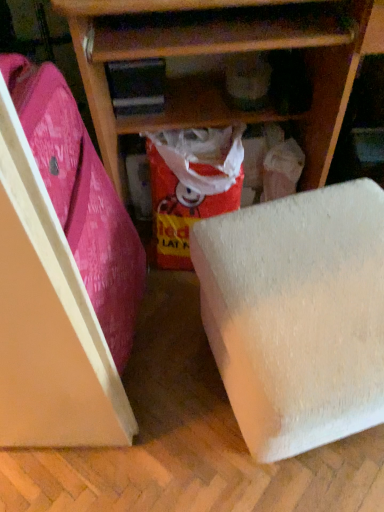
Find the location of `white foam block at lower right`. white foam block at lower right is located at coordinates (297, 315).

Describe the element at coordinates (297, 315) in the screenshot. I see `white foam block at lower right` at that location.

What is the approximate width of wooden shelf at center?

wooden shelf at center is 21.05 inches in width.

Find the location of `wooden shelf at center`. wooden shelf at center is located at coordinates (219, 74).

Measure the distance between red glossy paper at center and camera.

The depth of red glossy paper at center is 1.05 meters.

Find the location of a particular element. The width and height of the screenshot is (384, 512). pink fabric suitcase at left is located at coordinates (81, 198).

Is red glossy paper at center turned away from pink fabric suitcase at left?

No.

From a real-world perspective, is red glossy paper at center positioned above or below pink fabric suitcase at left?

Clearly, from a real-world perspective, red glossy paper at center is below pink fabric suitcase at left.

Is red glossy paper at center taller or shorter than pink fabric suitcase at left?

Considering their sizes, red glossy paper at center has less height than pink fabric suitcase at left.

From the image's perspective, is red glossy paper at center positioned above or below pink fabric suitcase at left?

Based on their image positions, red glossy paper at center is located above pink fabric suitcase at left.

The image size is (384, 512). I want to click on shelf that is on the left side of white foam block at lower right, so click(x=219, y=74).

In the scene shown: Are white foam block at lower right and wooden shelf at center far apart?

No, there isn't a large distance between white foam block at lower right and wooden shelf at center.

In terms of size, does white foam block at lower right appear bigger or smaller than wooden shelf at center?

In the image, white foam block at lower right appears to be smaller than wooden shelf at center.

From a real-world perspective, which object rests below the other?

white foam block at lower right.

Is the surface of red glossy paper at center in direct contact with wooden shelf at center?

There is a gap between red glossy paper at center and wooden shelf at center.

From the image's perspective, between red glossy paper at center and wooden shelf at center, who is located below?

red glossy paper at center, from the image's perspective.

Is red glossy paper at center looking in the opposite direction of wooden shelf at center?

That's right, red glossy paper at center is facing away from wooden shelf at center.

From the image's perspective, is pink fabric suitcase at left over red glossy paper at center?

No.

From a real-world perspective, is pink fabric suitcase at left over red glossy paper at center?

Yes, from a real-world perspective, pink fabric suitcase at left is above red glossy paper at center.

Is pink fabric suitcase at left directly adjacent to red glossy paper at center?

They are not placed beside each other.

Is red glossy paper at center touching white foam block at lower right?

red glossy paper at center is not next to white foam block at lower right, and they're not touching.

Image resolution: width=384 pixels, height=512 pixels. I want to click on wrapping paper above the white foam block at lower right (from the image's perspective), so click(x=191, y=185).

Based on the photo, considering the relative sizes of red glossy paper at center and white foam block at lower right in the image provided, is red glossy paper at center taller than white foam block at lower right?

No, red glossy paper at center is not taller than white foam block at lower right.

Is red glossy paper at center positioned beyond the bounds of white foam block at lower right?

red glossy paper at center is positioned outside white foam block at lower right.

Is red glossy paper at center inside white foam block at lower right?

Actually, red glossy paper at center is outside white foam block at lower right.

You are a GUI agent. You are given a task and a screenshot of the screen. Output one action in this format:
    pyautogui.click(x=<x>, y=<y>)
    Task: Click on the wrapping paper that appears behind the white foam block at lower right
    This screenshot has height=512, width=384.
    Given the screenshot: What is the action you would take?
    pyautogui.click(x=191, y=185)

Is there a large distance between white foam block at lower right and red glossy paper at center?

No, white foam block at lower right is in close proximity to red glossy paper at center.

In terms of width, does wooden shelf at center look wider or thinner when compared to white foam block at lower right?

Considering their sizes, wooden shelf at center looks broader than white foam block at lower right.

In the image, is wooden shelf at center positioned in front of or behind white foam block at lower right?

In the image, wooden shelf at center appears behind white foam block at lower right.

Is point (108, 98) positioned before point (297, 233)?

No, (108, 98) is further to viewer.

From a real-world perspective, relative to white foam block at lower right, is wooden shelf at center vertically above or below?

In terms of real-world spatial position, wooden shelf at center is above white foam block at lower right.

Identify the location of wrapping paper that appears below the pink fabric suitcase at left (from a real-world perspective). The height and width of the screenshot is (512, 384). (191, 185).

Locate an element on the screen. The image size is (384, 512). shelf above the white foam block at lower right (from a real-world perspective) is located at coordinates (219, 74).

From the image, which object appears to be farther from red glossy paper at center, pink fabric suitcase at left or wooden shelf at center?

pink fabric suitcase at left is further to red glossy paper at center.

Based on their spatial positions, is white foam block at lower right or red glossy paper at center closer to wooden shelf at center?

Among the two, red glossy paper at center is located nearer to wooden shelf at center.

From the image, which object appears to be nearer to pink fabric suitcase at left, white foam block at lower right or red glossy paper at center?

Among the two, red glossy paper at center is located nearer to pink fabric suitcase at left.

Looking at this image, which object lies nearer to the anchor point red glossy paper at center, pink fabric suitcase at left or white foam block at lower right?

The object closer to red glossy paper at center is pink fabric suitcase at left.

Estimate the real-world distances between objects in this image. Which object is closer to white foam block at lower right, pink fabric suitcase at left or wooden shelf at center?

pink fabric suitcase at left lies closer to white foam block at lower right than the other object.

From the image, which object appears to be nearer to wooden shelf at center, red glossy paper at center or pink fabric suitcase at left?

Among the two, red glossy paper at center is located nearer to wooden shelf at center.

Based on their spatial positions, is red glossy paper at center or wooden shelf at center further from white foam block at lower right?

wooden shelf at center lies further to white foam block at lower right than the other object.

Considering their positions, is wooden shelf at center positioned closer to pink fabric suitcase at left than white foam block at lower right?

wooden shelf at center is positioned closer to the anchor pink fabric suitcase at left.

At what (x,y) coordinates should I click in order to perform the action: click on shelf between pink fabric suitcase at left and white foam block at lower right. Please return your answer as a coordinate pair (x, y). Looking at the image, I should click on (219, 74).

Where is `wrapping paper that lies between wooden shelf at center and white foam block at lower right from top to bottom`? wrapping paper that lies between wooden shelf at center and white foam block at lower right from top to bottom is located at coordinates (191, 185).

At what (x,y) coordinates should I click in order to perform the action: click on furniture between pink fabric suitcase at left and red glossy paper at center in the front-back direction. Please return your answer as a coordinate pair (x, y). The image size is (384, 512). Looking at the image, I should click on (297, 315).

At what (x,y) coordinates should I click in order to perform the action: click on shelf positioned between pink fabric suitcase at left and red glossy paper at center from near to far. Please return your answer as a coordinate pair (x, y). Looking at the image, I should click on (219, 74).